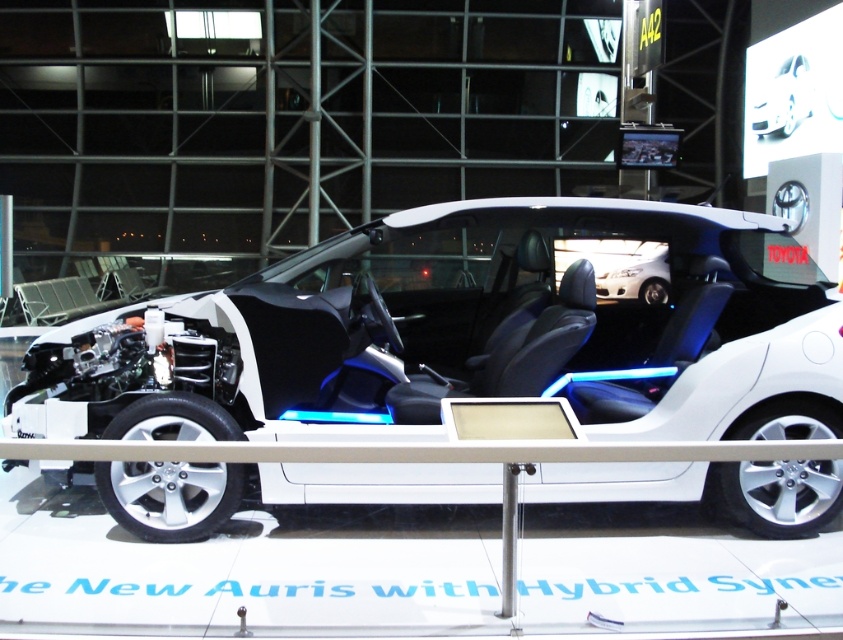
The image size is (843, 640). What are the coordinates of `white matte concept car at center` in the screenshot? It's located at (466, 333).

Who is more forward, (49, 381) or (795, 65)?

Point (49, 381) is in front.

Is point (423, 372) closer to viewer compared to point (779, 97)?

Yes, point (423, 372) is closer to viewer.

Locate an element on the screen. white matte concept car at center is located at coordinates pyautogui.click(x=466, y=333).